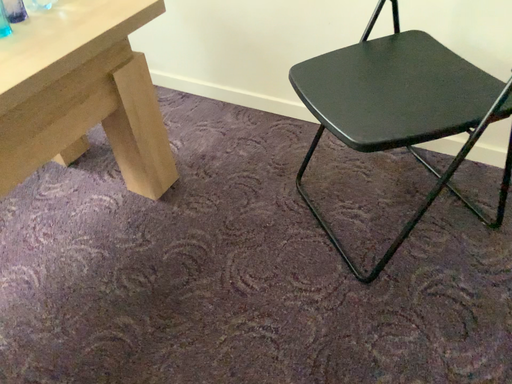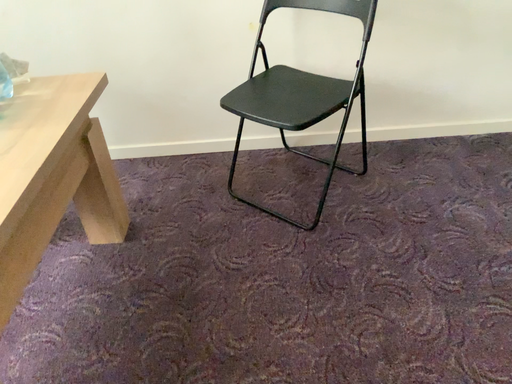
Question: How did the camera likely rotate when shooting the video?

Choices:
 (A) rotated upward
 (B) rotated downward

Answer: (A)